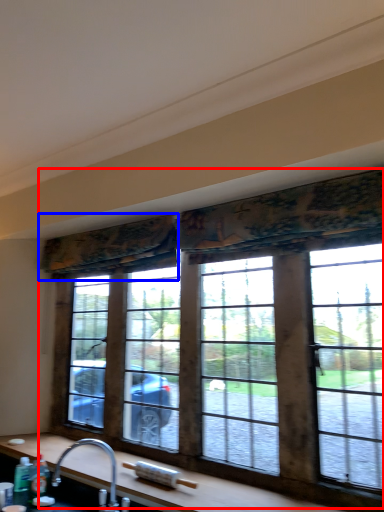
Question: Among these objects, which one is farthest to the camera, window (highlighted by a red box) or curtain (highlighted by a blue box)?

Choices:
 (A) window
 (B) curtain

Answer: (B)